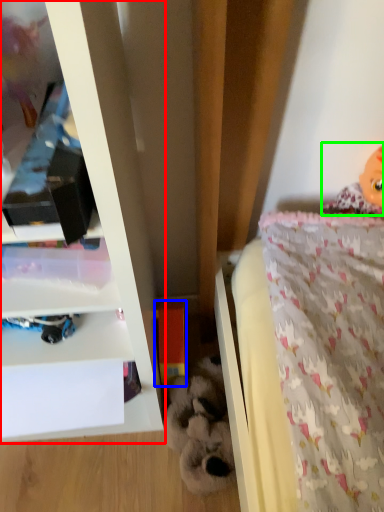
Question: Estimate the real-world distances between objects in this image. Which object is farther from shelf (highlighted by a red box), toy (highlighted by a blue box) or doll (highlighted by a green box)?

Choices:
 (A) toy
 (B) doll

Answer: (B)